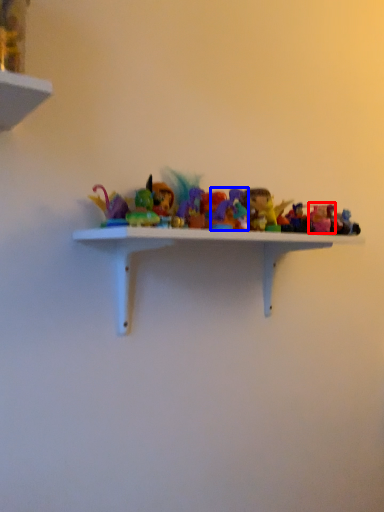
Question: Which of the following is the closest to the observer, toy (highlighted by a red box) or toy (highlighted by a blue box)?

Choices:
 (A) toy
 (B) toy

Answer: (B)